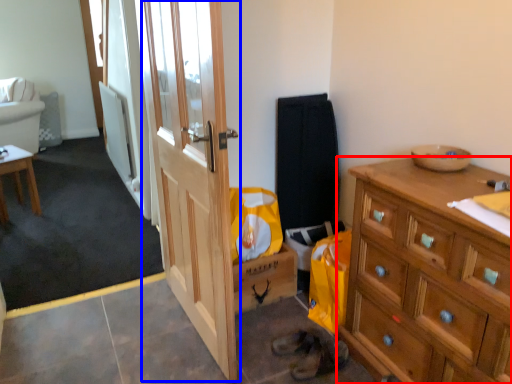
Question: Among these objects, which one is nearest to the camera, cabinetry (highlighted by a red box) or door (highlighted by a blue box)?

Choices:
 (A) cabinetry
 (B) door

Answer: (A)